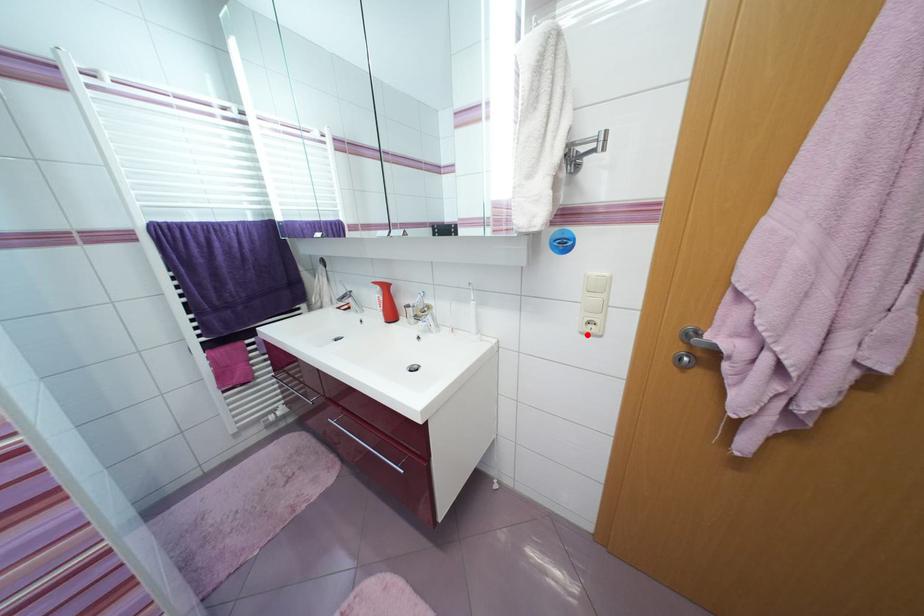
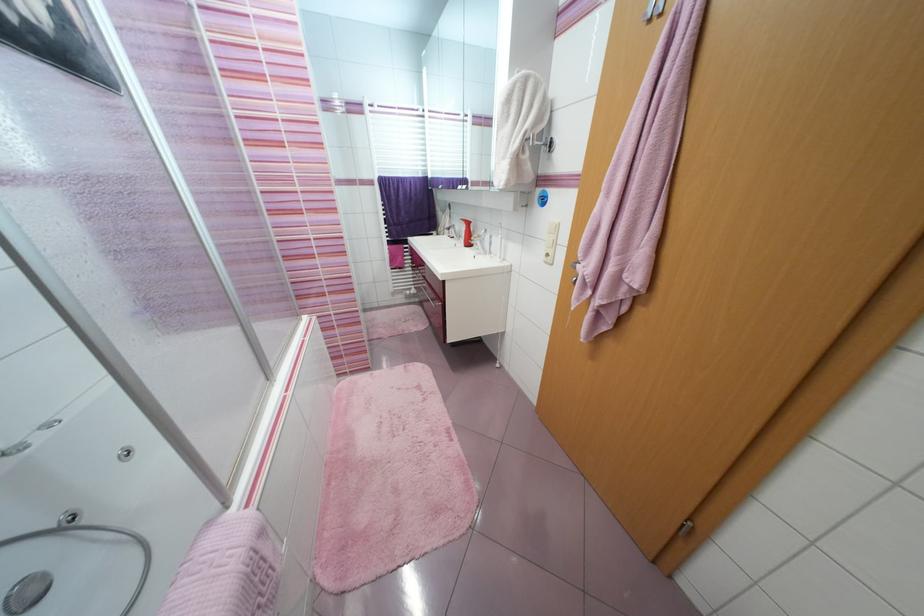
Question: I am providing you with two images of the same scene from different viewpoints. Given a red point in image1, look at the same physical point in image2. Is it:

Choices:
 (A) Closer to the viewpoint
 (B) Farther from the viewpoint

Answer: (A)